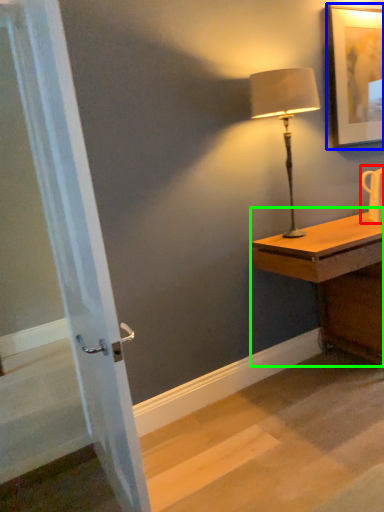
Question: Which is farther away from mug (highlighted by a red box)? picture frame (highlighted by a blue box) or desk (highlighted by a green box)?

Choices:
 (A) picture frame
 (B) desk

Answer: (A)